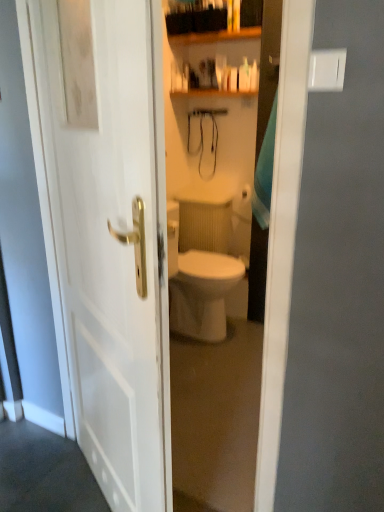
The image size is (384, 512). Describe the element at coordinates (213, 270) in the screenshot. I see `white glossy door at center` at that location.

You are a GUI agent. You are given a task and a screenshot of the screen. Output one action in this format:
    pyautogui.click(x=<x>, y=<y>)
    Task: Click on the white glossy door at center
    The height and width of the screenshot is (512, 384).
    Given the screenshot: What is the action you would take?
    pyautogui.click(x=213, y=270)

The width and height of the screenshot is (384, 512). What do you see at coordinates (244, 76) in the screenshot?
I see `white glossy soap dispenser at upper center` at bounding box center [244, 76].

At what (x,y) coordinates should I click in order to perform the action: click on white glossy soap dispenser at upper center. Please return your answer as a coordinate pair (x, y). The image size is (384, 512). Looking at the image, I should click on (244, 76).

What are the coordinates of `white glossy door at center` in the screenshot? It's located at (213, 270).

Which is more to the left, white glossy soap dispenser at upper center or white glossy door at center?

white glossy door at center.

Does white glossy soap dispenser at upper center lie behind white glossy door at center?

Yes, white glossy soap dispenser at upper center is further from the viewer.

Which is behind, point (247, 79) or point (235, 276)?

The point (247, 79) is farther from the camera.

From the image's perspective, is white glossy soap dispenser at upper center above or below white glossy door at center?

Clearly, from the image's perspective, white glossy soap dispenser at upper center is above white glossy door at center.

From a real-world perspective, is white glossy soap dispenser at upper center physically located above or below white glossy door at center?

white glossy soap dispenser at upper center is above white glossy door at center.

Considering the sizes of objects white glossy soap dispenser at upper center and white glossy door at center in the image provided, who is thinner, white glossy soap dispenser at upper center or white glossy door at center?

Thinner between the two is white glossy soap dispenser at upper center.

Who is shorter, white glossy soap dispenser at upper center or white glossy door at center?

Standing shorter between the two is white glossy soap dispenser at upper center.

Considering the sizes of objects white glossy soap dispenser at upper center and white glossy door at center in the image provided, who is bigger, white glossy soap dispenser at upper center or white glossy door at center?

white glossy door at center is bigger.

Is white glossy soap dispenser at upper center inside the boundaries of white glossy door at center, or outside?

white glossy soap dispenser at upper center is spatially situated outside white glossy door at center.

Is white glossy soap dispenser at upper center beside white glossy door at center?

No, white glossy soap dispenser at upper center is not touching white glossy door at center.

Could you tell me if white glossy soap dispenser at upper center is facing white glossy door at center?

Yes, white glossy soap dispenser at upper center is oriented towards white glossy door at center.

How many degrees apart are the facing directions of white glossy soap dispenser at upper center and white glossy door at center?

178 degrees.

Identify the location of toiletry above the white glossy door at center (from a real-world perspective). The height and width of the screenshot is (512, 384). (244, 76).

Is white glossy door at center at the right side of white glossy soap dispenser at upper center?

Incorrect, white glossy door at center is not on the right side of white glossy soap dispenser at upper center.

Considering the relative positions of white glossy door at center and white glossy soap dispenser at upper center in the image provided, is white glossy door at center in front of white glossy soap dispenser at upper center?

Yes, white glossy door at center is closer to the viewer.

Which is farther from the camera, (187,98) or (250,67)?

The point (187,98) is farther from the camera.

From the image's perspective, would you say white glossy door at center is shown under white glossy soap dispenser at upper center?

Yes.

From a real-world perspective, who is located lower, white glossy door at center or white glossy soap dispenser at upper center?

In real-world perspective, white glossy door at center is lower.

Is white glossy door at center wider or thinner than white glossy soap dispenser at upper center?

Considering their sizes, white glossy door at center looks broader than white glossy soap dispenser at upper center.

Which of these two, white glossy door at center or white glossy soap dispenser at upper center, stands shorter?

white glossy soap dispenser at upper center.

Considering the relative sizes of white glossy door at center and white glossy soap dispenser at upper center in the image provided, is white glossy door at center bigger than white glossy soap dispenser at upper center?

Correct, white glossy door at center is larger in size than white glossy soap dispenser at upper center.

Based on the photo, would you say white glossy soap dispenser at upper center is part of white glossy door at center's contents?

No, white glossy soap dispenser at upper center is not surrounded by white glossy door at center.

Is white glossy door at center not close to white glossy soap dispenser at upper center?

white glossy door at center is actually quite close to white glossy soap dispenser at upper center.

Is white glossy door at center oriented towards white glossy soap dispenser at upper center?

Yes, white glossy door at center is turned towards white glossy soap dispenser at upper center.

How different are the orientations of white glossy door at center and white glossy soap dispenser at upper center in degrees?

They differ by 178 degrees in their facing directions.

There is a white glossy door at center. What are the coordinates of `toiletry above it (from a real-world perspective)` in the screenshot? It's located at click(x=244, y=76).

This screenshot has width=384, height=512. I want to click on glass door beneath the white glossy soap dispenser at upper center (from a real-world perspective), so click(213, 270).

Locate an element on the screen. The height and width of the screenshot is (512, 384). glass door in front of the white glossy soap dispenser at upper center is located at coordinates (213, 270).